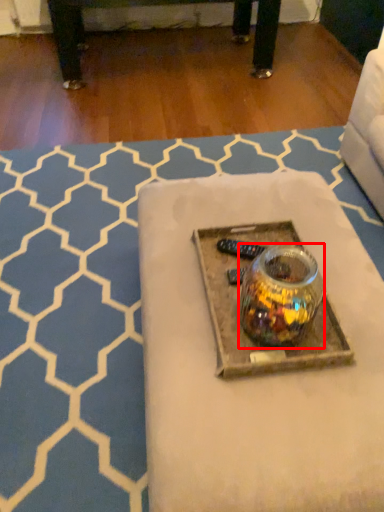
Question: From the image's perspective, what is the correct spatial positioning of glass jar (annotated by the red box) in reference to table?

Choices:
 (A) below
 (B) above

Answer: (A)